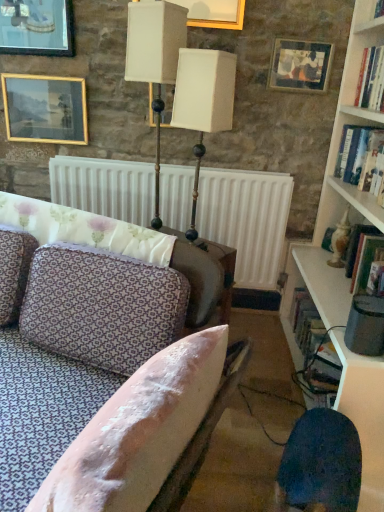
Find the location of a particular element. gold-framed painting at upper left, which is the first picture frame from left to right is located at coordinates (45, 109).

What do you see at coordinates (358, 47) in the screenshot? This screenshot has height=512, width=384. I see `white wooden bookshelf at upper right` at bounding box center [358, 47].

This screenshot has height=512, width=384. Identify the location of gold-framed picture at upper left, which appears as the second picture frame when viewed from the left. (37, 27).

How much space does hardcover book at upper right, which ranks as the first book in right-to-left order, occupy vertically?

hardcover book at upper right, which ranks as the first book in right-to-left order, is 10.89 inches tall.

The height and width of the screenshot is (512, 384). What do you see at coordinates (338, 188) in the screenshot?
I see `white wooden bookcase at right` at bounding box center [338, 188].

Find the location of a particular element. This screenshot has width=384, height=512. patterned fabric couch at center is located at coordinates point(120,358).

In order to click on gold-framed painting at upper left, which is the first picture frame from left to right in this screenshot , I will do `click(45, 109)`.

From a real-world perspective, who is located lower, white wooden bookshelf at upper right or hardcover book at upper right, marked as the third book in a left-to-right arrangement?

hardcover book at upper right, marked as the third book in a left-to-right arrangement, from a real-world perspective.

From the image's perspective, which is above, white wooden bookshelf at upper right or hardcover book at upper right, which is the 2th book from top to bottom?

white wooden bookshelf at upper right, from the image's perspective.

Would you say hardcover book at upper right, which is the 2th book from top to bottom, is part of white wooden bookshelf at upper right's contents?

Actually, hardcover book at upper right, which is the 2th book from top to bottom, is outside white wooden bookshelf at upper right.

Is white wooden bookshelf at upper right next to hardcover book at upper right, the 2th book in the bottom-to-top sequence?

No, white wooden bookshelf at upper right is not beside hardcover book at upper right, the 2th book in the bottom-to-top sequence.

From the image's perspective, is cream matte table lamp at center, the 2th table lamp when ordered from left to right, above hardcover book at upper right, the 2th book from the front?

Actually, cream matte table lamp at center, the 2th table lamp when ordered from left to right, appears below hardcover book at upper right, the 2th book from the front, in the image.

How different are the orientations of cream matte table lamp at center, marked as the first table lamp in a right-to-left arrangement, and hardcover book at upper right, the 2th book positioned from the left, in degrees?

58 degrees separate the facing orientations of cream matte table lamp at center, marked as the first table lamp in a right-to-left arrangement, and hardcover book at upper right, the 2th book positioned from the left.

Between cream matte table lamp at center, the 2th table lamp when ordered from left to right, and hardcover book at upper right, which is the second book in right-to-left order, which one appears on the left side from the viewer's perspective?

From the viewer's perspective, cream matte table lamp at center, the 2th table lamp when ordered from left to right, appears more on the left side.

What's the angular difference between white wooden bookshelf at upper right and white wooden bookcase at right's facing directions?

The angle between the facing direction of white wooden bookshelf at upper right and the facing direction of white wooden bookcase at right is 0.806 degrees.

Is point (349, 78) farther from viewer compared to point (321, 193)?

No, (349, 78) is closer to viewer.

From the image's perspective, is white wooden bookshelf at upper right located above or below white wooden bookcase at right?

From the image's perspective, white wooden bookshelf at upper right appears above white wooden bookcase at right.

Is metallic gold table lamp at upper center, the 2th table lamp positioned from the right, touching hardcover book at upper right, which ranks as the first book in right-to-left order?

metallic gold table lamp at upper center, the 2th table lamp positioned from the right, is not next to hardcover book at upper right, which ranks as the first book in right-to-left order, and they're not touching.

Between metallic gold table lamp at upper center, the 2th table lamp positioned from the right, and hardcover book at upper right, marked as the third book in a left-to-right arrangement, which one has smaller width?

metallic gold table lamp at upper center, the 2th table lamp positioned from the right, is thinner.

Does point (131, 50) lie behind point (348, 136)?

No, (131, 50) is in front of (348, 136).

From a real-world perspective, does metallic gold table lamp at upper center, placed as the 1th table lamp when sorted from left to right, stand above hardcover book at upper right, which ranks as the first book in right-to-left order?

Yes, from a real-world perspective, metallic gold table lamp at upper center, placed as the 1th table lamp when sorted from left to right, is above hardcover book at upper right, which ranks as the first book in right-to-left order.

Does point (215, 68) come in front of point (264, 180)?

Yes, point (215, 68) is closer to viewer.

From a real-world perspective, which object rests below the other?

white matte radiator at center.

Which of these two, cream matte table lamp at center, marked as the first table lamp in a right-to-left arrangement, or white matte radiator at center, is thinner?

With smaller width is white matte radiator at center.

Does cream matte table lamp at center, the 2th table lamp when ordered from left to right, appear on the left side of white matte radiator at center?

No.

Does white wooden bookshelf at upper right have a larger size compared to patterned fabric couch at center?

Incorrect, white wooden bookshelf at upper right is not larger than patterned fabric couch at center.

Which is more distant, [352,84] or [100,501]?

The point [352,84] is behind.

From a real-world perspective, between white wooden bookshelf at upper right and patterned fabric couch at center, who is vertically higher?

white wooden bookshelf at upper right is physically above.

From a real-world perspective, is gold-framed picture at upper left, the 2th picture frame viewed from the right, located higher than patterned fabric couch at center?

Yes.

Considering the relative positions of gold-framed picture at upper left, which appears as the second picture frame when viewed from the left, and patterned fabric couch at center in the image provided, is gold-framed picture at upper left, which appears as the second picture frame when viewed from the left, in front of patterned fabric couch at center?

That is False.

Is gold-framed picture at upper left, which appears as the second picture frame when viewed from the left, not within patterned fabric couch at center?

Yes, gold-framed picture at upper left, which appears as the second picture frame when viewed from the left, is not within patterned fabric couch at center.

From a real-world perspective, count 1st books downward from the white wooden bookshelf at upper right and point to it. Please provide its 2D coordinates.

[(358, 155)]

Image resolution: width=384 pixels, height=512 pixels. In order to click on table lamp that is the 2nd object located in front of the hardcover book at upper right, which ranks as the first book in top-to-bottom order in this screenshot , I will do `click(203, 102)`.

Based on their spatial positions, is cream matte table lamp at center, marked as the first table lamp in a right-to-left arrangement, or hardcover book at upper right, marked as the third book in a left-to-right arrangement, further from white matte radiator at center?

hardcover book at upper right, marked as the third book in a left-to-right arrangement, is further to white matte radiator at center.

From the image, which object appears to be nearer to hardcover book at upper right, which ranks as the first book in top-to-bottom order, cream matte table lamp at center, the 2th table lamp when ordered from left to right, or wooden picture frame at upper right, the 1th picture frame in the right-to-left sequence?

wooden picture frame at upper right, the 1th picture frame in the right-to-left sequence, is positioned closer to the anchor hardcover book at upper right, which ranks as the first book in top-to-bottom order.

Looking at the image, which one is located further to wooden picture frame at upper right, which ranks as the third picture frame in left-to-right order, hardcover book at right, which is counted as the first book, starting from the bottom, or white wooden bookshelf at upper right?

hardcover book at right, which is counted as the first book, starting from the bottom.

When comparing their distances from white wooden bookshelf at upper right, does wooden picture frame at upper right, which ranks as the third picture frame in left-to-right order, or gold-framed picture at upper left, which appears as the second picture frame when viewed from the left, seem further?

Among the two, gold-framed picture at upper left, which appears as the second picture frame when viewed from the left, is located further to white wooden bookshelf at upper right.

Looking at this image, estimate the real-world distances between objects in this image. Which object is closer to gold-framed painting at upper left, arranged as the 3th picture frame when viewed from the right, metallic gold table lamp at upper center, the 2th table lamp positioned from the right, or white wooden bookcase at right?

The object closer to gold-framed painting at upper left, arranged as the 3th picture frame when viewed from the right, is metallic gold table lamp at upper center, the 2th table lamp positioned from the right.

Which object lies further to the anchor point hardcover book at upper right, which is the 2th book from top to bottom, white wooden bookcase at right or white wooden bookshelf at upper right?

white wooden bookshelf at upper right lies further to hardcover book at upper right, which is the 2th book from top to bottom, than the other object.

Consider the image. Based on their spatial positions, is hardcover book at upper right, which ranks as the 3th book in back-to-front order, or metallic gold table lamp at upper center, the 2th table lamp positioned from the right, further from white wooden bookcase at right?

metallic gold table lamp at upper center, the 2th table lamp positioned from the right, lies further to white wooden bookcase at right than the other object.

When comparing their distances from white wooden bookcase at right, does wooden picture frame at upper right, which ranks as the third picture frame in left-to-right order, or gold-framed picture at upper left, which appears as the second picture frame when viewed from the left, seem closer?

wooden picture frame at upper right, which ranks as the third picture frame in left-to-right order.

Where is `radiator between gold-framed painting at upper left, which is the first picture frame from left to right, and wooden picture frame at upper right, the 1th picture frame in the right-to-left sequence, in the horizontal direction`? The image size is (384, 512). radiator between gold-framed painting at upper left, which is the first picture frame from left to right, and wooden picture frame at upper right, the 1th picture frame in the right-to-left sequence, in the horizontal direction is located at coordinates (246, 220).

You are a GUI agent. You are given a task and a screenshot of the screen. Output one action in this format:
    pyautogui.click(x=<x>, y=<y>)
    Task: Click on the radiator between gold-framed painting at upper left, which is the first picture frame from left to right, and cream matte table lamp at center, the 2th table lamp when ordered from left to right
    
    Given the screenshot: What is the action you would take?
    pyautogui.click(x=246, y=220)

Where is `bookcase located between metallic gold table lamp at upper center, the 2th table lamp positioned from the right, and hardcover book at upper right, which is the second book in right-to-left order, in the left-right direction`? The image size is (384, 512). bookcase located between metallic gold table lamp at upper center, the 2th table lamp positioned from the right, and hardcover book at upper right, which is the second book in right-to-left order, in the left-right direction is located at coordinates (338, 188).

Locate an element on the screen. studio couch located between gold-framed picture at upper left, the 2th picture frame viewed from the right, and white wooden bookcase at right in the left-right direction is located at coordinates (120, 358).